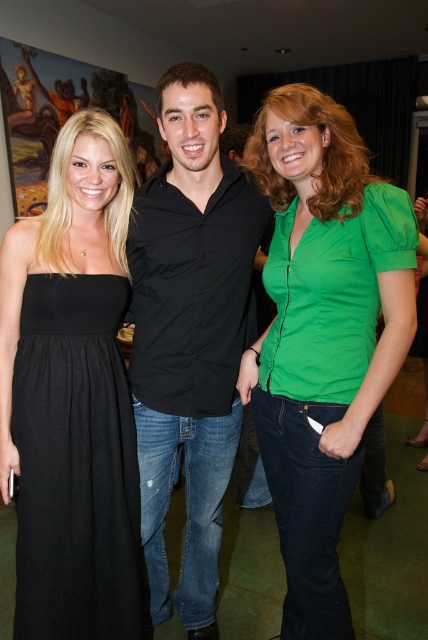
Question: Is green matte shirt at center below black cotton dress at left?

Choices:
 (A) yes
 (B) no

Answer: (B)

Question: Which object appears closest to the camera in this image?

Choices:
 (A) black cotton dress at left
 (B) green matte shirt at center
 (C) black smooth shirt at center

Answer: (B)

Question: Which of the following is the closest to the observer?

Choices:
 (A) black smooth shirt at center
 (B) black cotton dress at left

Answer: (A)

Question: Is green matte shirt at center closer to the viewer compared to black cotton dress at left?

Choices:
 (A) no
 (B) yes

Answer: (B)

Question: Is green matte shirt at center closer to camera compared to black cotton dress at left?

Choices:
 (A) yes
 (B) no

Answer: (A)

Question: Which is nearer to the black smooth shirt at center?

Choices:
 (A) black cotton dress at left
 (B) green matte shirt at center

Answer: (A)